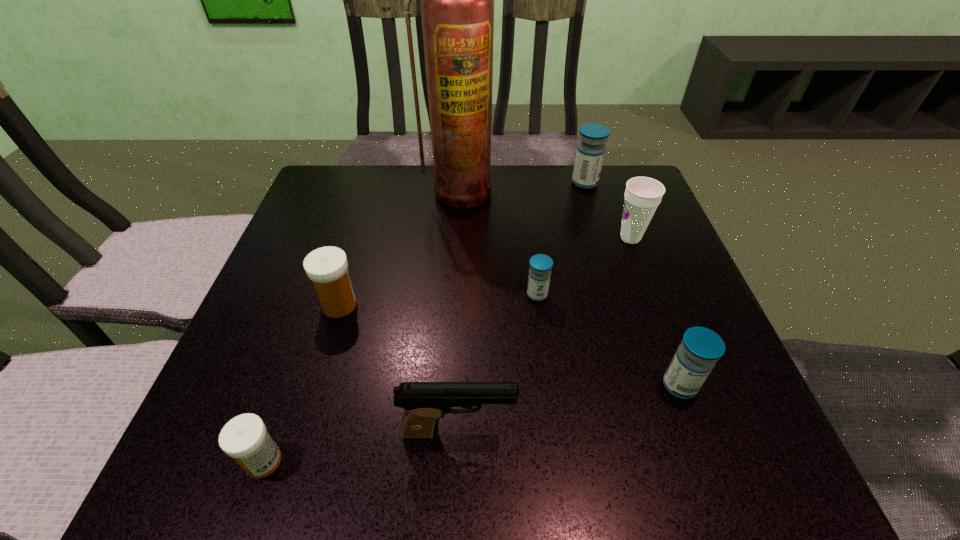
The image size is (960, 540). Identify the location of free spot between the fire extinguisher and the smaller white medicine. (361, 326).

In order to click on vacant point located between the second nearest medicine and the third medicine from right to left in this screenshot , I will do click(609, 340).

At what (x,y) coordinates should I click in order to perform the action: click on free space between the fourth farthest medicine and the purple cup. Please return your answer as a coordinate pair (x, y). Looking at the image, I should click on (655, 312).

At what (x,y) coordinates should I click in order to perform the action: click on vacant area that lies between the second nearest blue medicine and the biggest blue medicine. Please return your answer as a coordinate pair (x, y). Image resolution: width=960 pixels, height=540 pixels. Looking at the image, I should click on (561, 239).

Locate an element on the screen. The image size is (960, 540). vacant area that lies between the smaller white medicine and the tallest medicine is located at coordinates (424, 322).

At what (x,y) coordinates should I click in order to perform the action: click on free spot between the nearest blue medicine and the tallest medicine. Please return your answer as a coordinate pair (x, y). Looking at the image, I should click on (633, 284).

Find the location of `free space between the red fire extinguisher and the nearest object`. free space between the red fire extinguisher and the nearest object is located at coordinates (361, 326).

Identify the location of free point between the second nearest object and the purple cup. (544, 335).

The width and height of the screenshot is (960, 540). In order to click on object that is the fifth closest to the tallest object in this screenshot , I will do `click(700, 349)`.

Locate which object ranks second in proximity to the third nearest object. Please provide its 2D coordinates. Your answer should be formatted as a tuple, i.e. [(x, y)], where the tuple contains the x and y coordinates of a point satisfying the conditions above.

[(424, 403)]